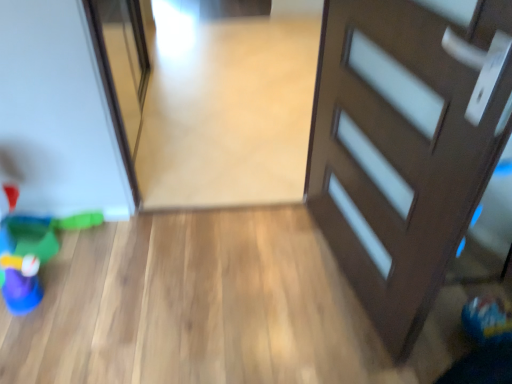
The image size is (512, 384). Describe the element at coordinates (122, 72) in the screenshot. I see `transparent glass screen door at left` at that location.

In order to face transparent glass screen door at left, should I rotate leftwards or rightwards?

You should look left and rotate roughly 17.234 degrees.

The image size is (512, 384). In order to click on transparent glass screen door at left in this screenshot , I will do `click(122, 72)`.

Locate an element on the screen. transparent glass screen door at left is located at coordinates (122, 72).